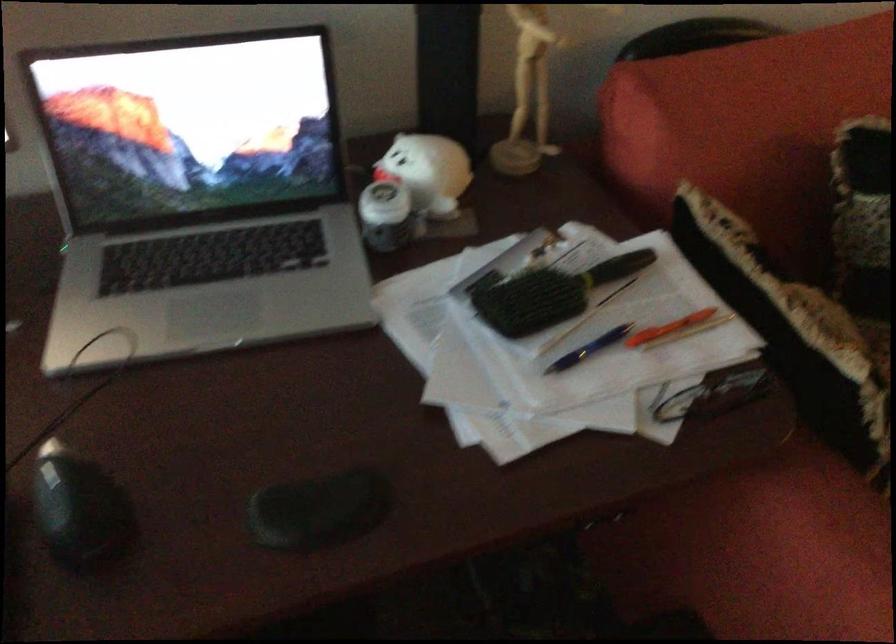
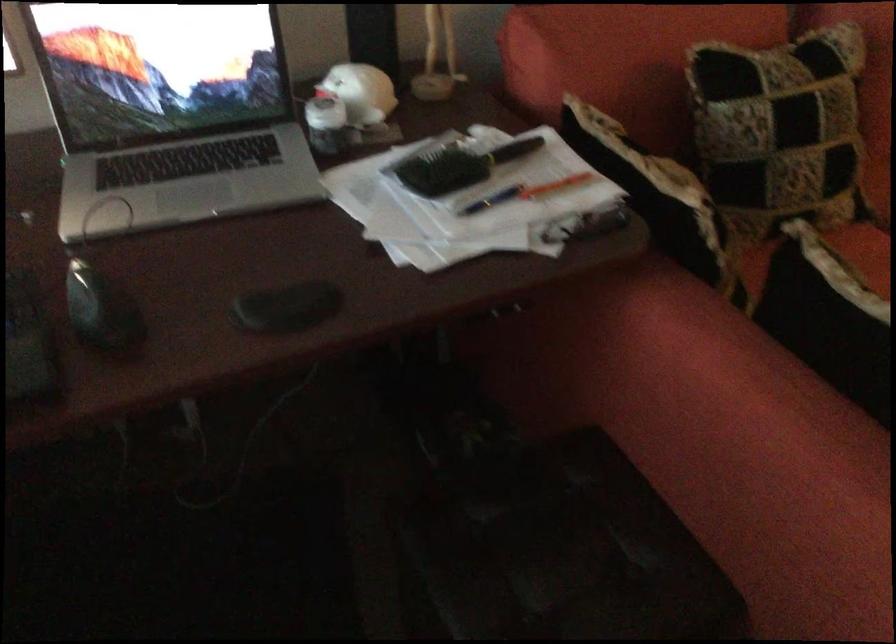
Question: The camera is either moving clockwise (left) or counter-clockwise (right) around the object. The first image is from the beginning of the video and the second image is from the end. Is the camera moving left or right when shooting the video?

Choices:
 (A) Left
 (B) Right

Answer: (A)